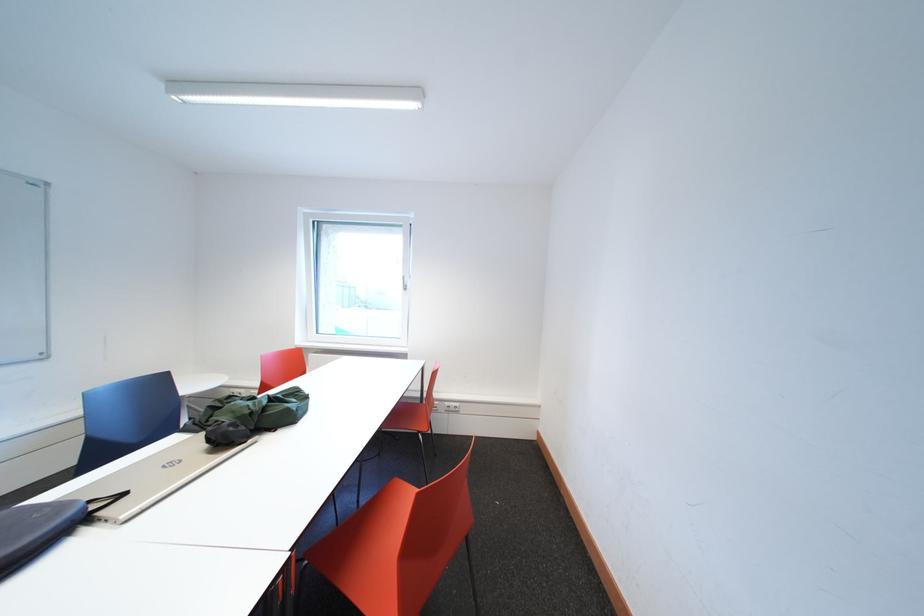
Where would you turn the white window handle? Please return your answer as a coordinate pair (x, y).

(406, 275)